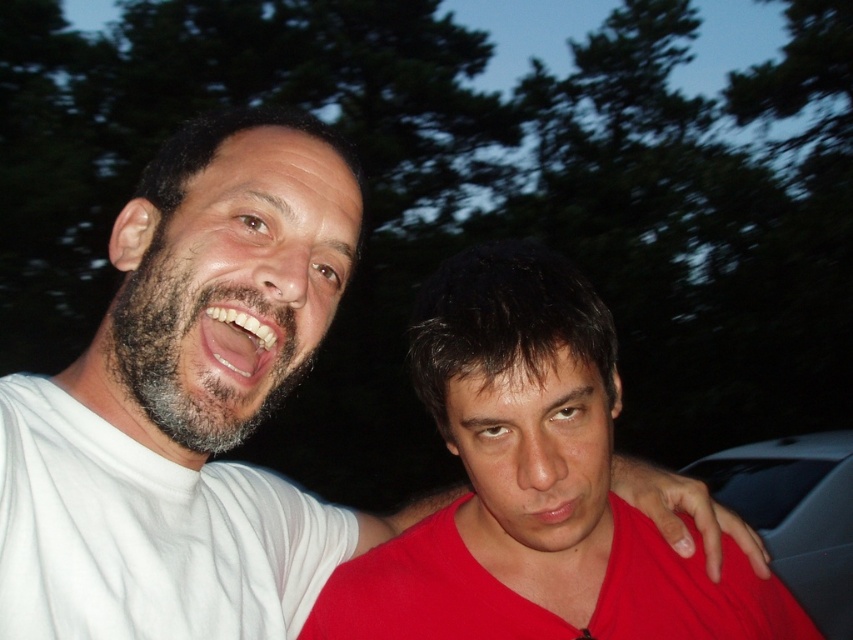
Question: Does matte red shirt at center appear on the left side of dark gray metallic car at right?

Choices:
 (A) yes
 (B) no

Answer: (A)

Question: Which of the following is the closest to the observer?

Choices:
 (A) matte red shirt at center
 (B) dark gray metallic car at right

Answer: (A)

Question: Is matte red shirt at center wider than dark gray metallic car at right?

Choices:
 (A) yes
 (B) no

Answer: (B)

Question: Among these points, which one is farthest from the camera?

Choices:
 (A) (669, 612)
 (B) (788, 545)

Answer: (B)

Question: Which point appears closest to the camera in this image?

Choices:
 (A) (547, 627)
 (B) (814, 488)

Answer: (A)

Question: Does matte red shirt at center appear on the right side of dark gray metallic car at right?

Choices:
 (A) no
 (B) yes

Answer: (A)